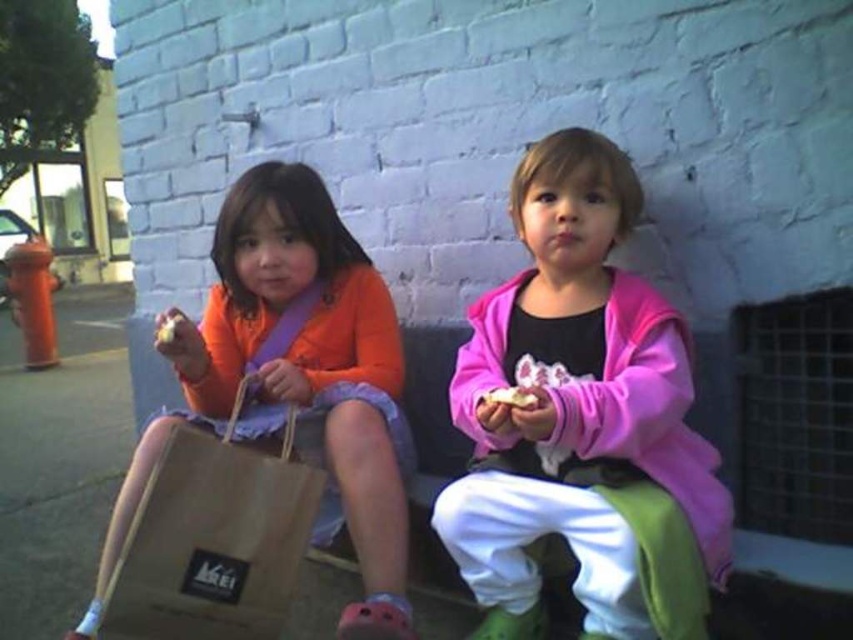
Question: Is pink fleece jacket at center thinner than white crumbly food at center?

Choices:
 (A) yes
 (B) no

Answer: (B)

Question: Which of the following is the farthest from the observer?

Choices:
 (A) (355, 301)
 (B) (178, 317)

Answer: (A)

Question: Is brown paper bag at left smaller than white crumbly bread at center?

Choices:
 (A) no
 (B) yes

Answer: (A)

Question: Among these points, which one is nearest to the camera?

Choices:
 (A) (526, 394)
 (B) (396, 627)
 (C) (125, 577)

Answer: (A)

Question: Among these objects, which one is farthest from the camera?

Choices:
 (A) pink fleece jacket at center
 (B) white crumbly bread at center
 (C) white crumbly food at center

Answer: (B)

Question: Is pink fleece jacket at center below matte brown paper bag at left?

Choices:
 (A) yes
 (B) no

Answer: (B)